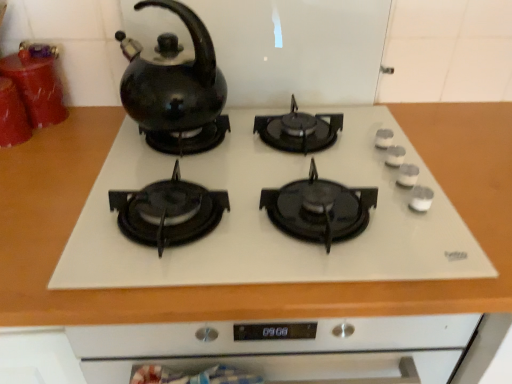
You are a GUI agent. You are given a task and a screenshot of the screen. Output one action in this format:
    pyautogui.click(x=<x>, y=<y>)
    Task: Click on the vacant region to the right of matte red canister at left, the second kitchen appliance viewed from the back
    This screenshot has width=512, height=384.
    Given the screenshot: What is the action you would take?
    pyautogui.click(x=76, y=135)